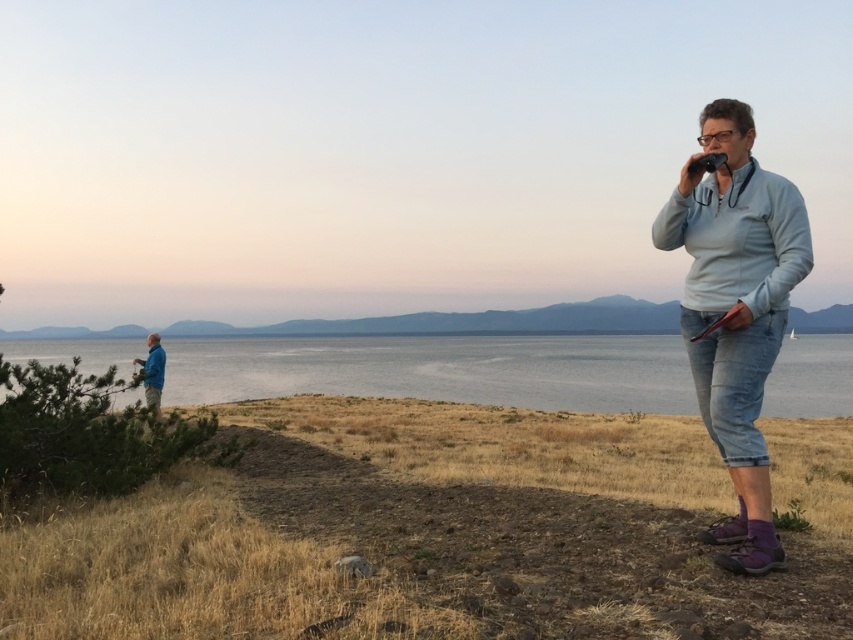
In the scene shown: You are standing in the scene and want to take a photo of the smooth blue water at center using the blue fabric jacket at left as a foreground element. Is the jacket positioned to the left or right of the water?

The smooth blue water at center is positioned on the right side of blue fabric jacket at left, so the jacket is to the left of the water.

You are standing in the outdoor scene and want to take a photo of both the point at coordinates point (535, 390) and point (781, 564). Which point should you focus on first to ensure both are in clear view?

You should focus on point (535, 390) first because it is closer to the camera than point (781, 564). This ensures both points are within the depth of field and in clear view.

You are standing in the scene and want to take a photo of the light blue fleece at right. Where should you position yourself to capture it in the center of your camera frame?

To center the light blue fleece at right in your camera frame, position yourself so that the camera is aimed directly at the coordinates corresponding to point 0.377 on the horizontal axis and 0.866 on the vertical axis.